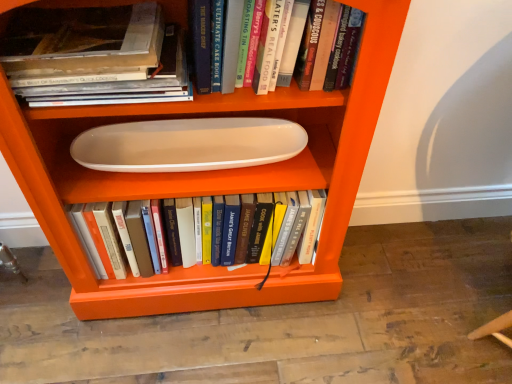
Question: Is matte white book at upper left, which is counted as the 2th book, starting from the front, far from white glossy oval tray at center?

Choices:
 (A) yes
 (B) no

Answer: (B)

Question: Can you confirm if matte white book at upper left, arranged as the 2th book when viewed from the back, is thinner than white glossy oval tray at center?

Choices:
 (A) no
 (B) yes

Answer: (B)

Question: From a real-world perspective, is matte white book at upper left, arranged as the 2th book when viewed from the back, on top of white glossy oval tray at center?

Choices:
 (A) no
 (B) yes

Answer: (B)

Question: Can you confirm if matte white book at upper left, which is counted as the 2th book, starting from the front, is positioned to the right of white glossy oval tray at center?

Choices:
 (A) no
 (B) yes

Answer: (A)

Question: Does matte white book at upper left, arranged as the 2th book when viewed from the back, turn towards white glossy oval tray at center?

Choices:
 (A) yes
 (B) no

Answer: (A)

Question: Relative to matte white book at upper left, which is counted as the 2th book, starting from the front, is white glossy oval tray at center in front or behind?

Choices:
 (A) behind
 (B) front

Answer: (B)

Question: Looking at their shapes, would you say white glossy oval tray at center is wider or thinner than matte white book at upper left, arranged as the 2th book when viewed from the back?

Choices:
 (A) wide
 (B) thin

Answer: (A)

Question: From the image's perspective, is white glossy oval tray at center located above or below matte white book at upper left, arranged as the 2th book when viewed from the back?

Choices:
 (A) below
 (B) above

Answer: (A)

Question: Looking at the image, does white glossy oval tray at center seem bigger or smaller compared to matte white book at upper left, arranged as the 2th book when viewed from the back?

Choices:
 (A) small
 (B) big

Answer: (B)

Question: Do you think white matte oval plate at center, marked as the 3th book in a front-to-back arrangement, is within white glossy oval plate at center, or outside of it?

Choices:
 (A) outside
 (B) inside

Answer: (A)

Question: Is point (108, 225) positioned closer to the camera than point (233, 158)?

Choices:
 (A) farther
 (B) closer

Answer: (B)

Question: In the image, is white matte oval plate at center, marked as the 3th book in a front-to-back arrangement, on the left side or the right side of white glossy oval plate at center?

Choices:
 (A) right
 (B) left

Answer: (A)

Question: Is white matte oval plate at center, marked as the 3th book in a front-to-back arrangement, wider or thinner than white glossy oval plate at center?

Choices:
 (A) thin
 (B) wide

Answer: (B)

Question: From a real-world perspective, is white glossy oval plate at center physically located above or below white glossy oval tray at center?

Choices:
 (A) above
 (B) below

Answer: (A)

Question: Considering the relative positions of white glossy oval plate at center and white glossy oval tray at center in the image provided, is white glossy oval plate at center to the left or to the right of white glossy oval tray at center?

Choices:
 (A) left
 (B) right

Answer: (A)